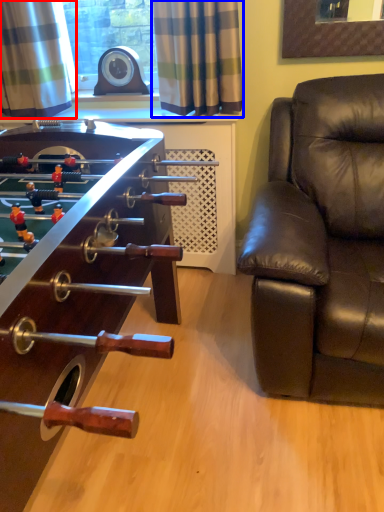
Question: Among these objects, which one is nearest to the camera, curtain (highlighted by a red box) or curtain (highlighted by a blue box)?

Choices:
 (A) curtain
 (B) curtain

Answer: (B)